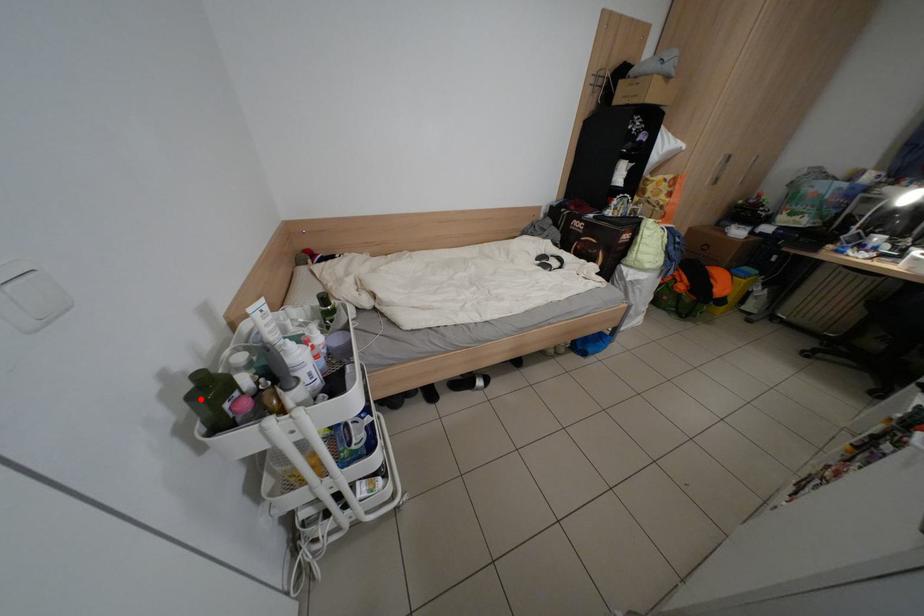
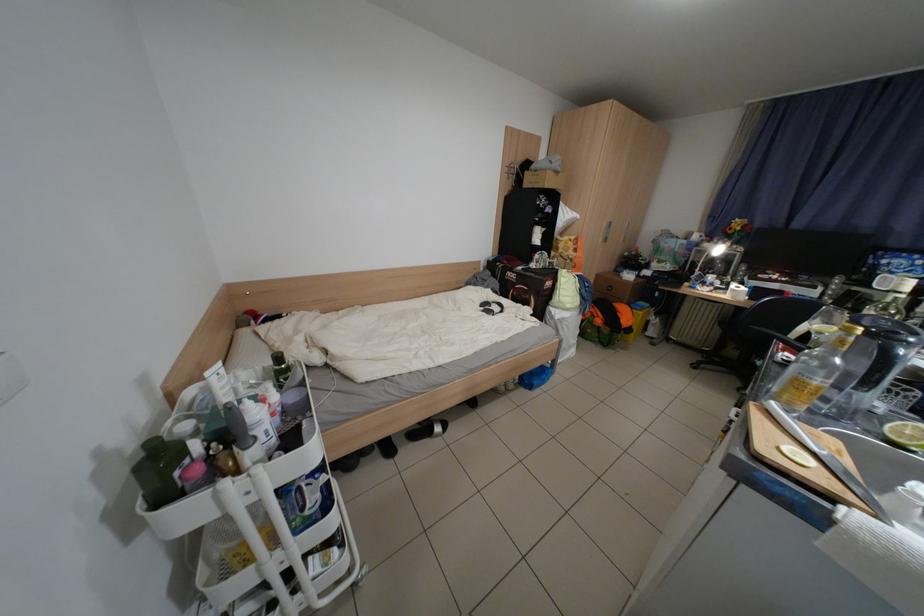
Locate, in the second image, the point that corresponds to the highlighted location in the first image.

(149, 471)